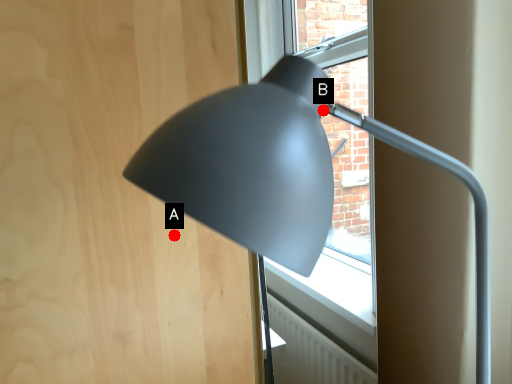
Question: Two points are circled on the image, labeled by A and B beside each circle. Which point is closer to the camera?

Choices:
 (A) A is closer
 (B) B is closer

Answer: (B)